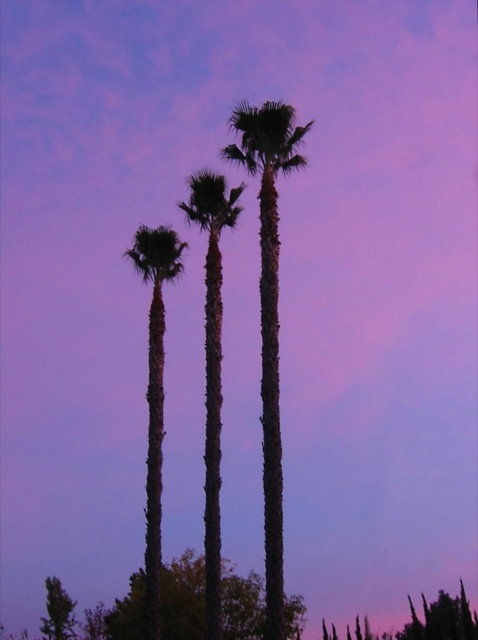
Does point (126, 637) lie behind point (217, 584)?

Yes, it is.

Who is more distant from viewer, (166, 625) or (215, 566)?

The point (166, 625) is behind.

Is point (127, 637) behind point (206, 298)?

Yes, point (127, 637) is farther from viewer.

At what (x,y) coordinates should I click in order to perform the action: click on green leafy tree at lower center. Please return your answer as a coordinate pair (x, y). The image size is (478, 640). Looking at the image, I should click on (183, 596).

Does silhouette bark palm at center appear over silhouette palm tree at center?

Yes, silhouette bark palm at center is above silhouette palm tree at center.

Locate an element on the screen. This screenshot has height=640, width=478. silhouette bark palm at center is located at coordinates (213, 368).

Who is more forward, (214, 408) or (161, 296)?

Point (214, 408)

Find the location of `silhouette bark palm at center`. silhouette bark palm at center is located at coordinates (213, 368).

Who is positioned more to the left, green textured palm tree at center or silhouette bark palm at center?

From the viewer's perspective, silhouette bark palm at center appears more on the left side.

Is point (294, 154) positioned before point (219, 596)?

No, (294, 154) is further to viewer.

Is point (262, 296) positioned in front of point (207, 492)?

That is True.

Image resolution: width=478 pixels, height=640 pixels. Find the location of `green textured palm tree at center`. green textured palm tree at center is located at coordinates (269, 312).